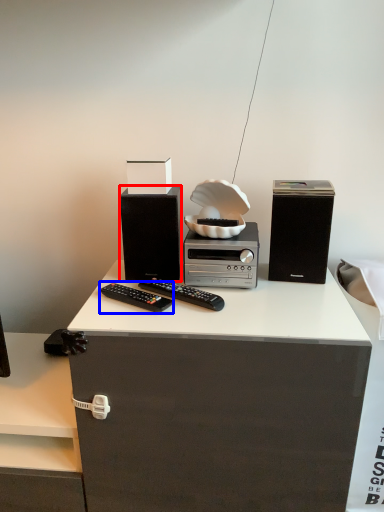
Question: Which object is closer to the camera taking this photo, speaker (highlighted by a red box) or remote control (highlighted by a blue box)?

Choices:
 (A) speaker
 (B) remote control

Answer: (B)